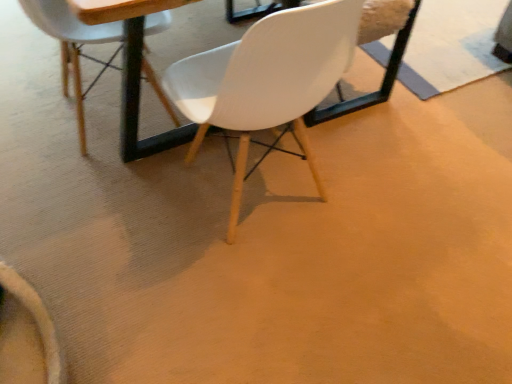
Image resolution: width=512 pixels, height=384 pixels. In order to click on white matte chair at center, the second chair from the left in this screenshot , I will do `click(266, 79)`.

Considering the relative sizes of matte white chair at upper center, which appears as the first chair when viewed from the left, and wooden round table at center in the image provided, is matte white chair at upper center, which appears as the first chair when viewed from the left, bigger than wooden round table at center?

No, matte white chair at upper center, which appears as the first chair when viewed from the left, is not bigger than wooden round table at center.

Which point is more forward, (159, 98) or (188, 2)?

Point (188, 2)

Between matte white chair at upper center, which appears as the first chair when viewed from the left, and wooden round table at center, which one has more height?

wooden round table at center.

From the image's perspective, is matte white chair at upper center, which ranks as the second chair in right-to-left order, positioned above or below wooden round table at center?

matte white chair at upper center, which ranks as the second chair in right-to-left order, is below wooden round table at center.

Can you confirm if white matte chair at center, acting as the 1th chair starting from the right, is positioned to the right of wooden round table at center?

Yes.

Which of these two, white matte chair at center, the second chair from the left, or wooden round table at center, stands taller?

white matte chair at center, the second chair from the left, is taller.

Can wooden round table at center be found inside white matte chair at center, acting as the 1th chair starting from the right?

No, wooden round table at center is not surrounded by white matte chair at center, acting as the 1th chair starting from the right.

Which is behind, point (195, 137) or point (96, 3)?

The point (195, 137) is farther from the camera.

Between point (79, 75) and point (243, 156), which one is positioned in front?

The point (243, 156) is closer to the camera.

Can you confirm if matte white chair at upper center, which ranks as the second chair in right-to-left order, is thinner than white matte chair at center, acting as the 1th chair starting from the right?

In fact, matte white chair at upper center, which ranks as the second chair in right-to-left order, might be wider than white matte chair at center, acting as the 1th chair starting from the right.

Is matte white chair at upper center, which appears as the first chair when viewed from the left, shorter than white matte chair at center, the second chair from the left?

Yes, matte white chair at upper center, which appears as the first chair when viewed from the left, is shorter than white matte chair at center, the second chair from the left.

How much distance is there between matte white chair at upper center, which appears as the first chair when viewed from the left, and white matte chair at center, the second chair from the left?

They are 20.39 inches apart.

Is white matte chair at center, acting as the 1th chair starting from the right, completely or partially inside wooden round table at center?

Yes, white matte chair at center, acting as the 1th chair starting from the right, is inside wooden round table at center.

Is wooden round table at center aimed at white matte chair at center, the second chair from the left?

No, wooden round table at center is not aimed at white matte chair at center, the second chair from the left.

Does wooden round table at center have a lesser width compared to white matte chair at center, the second chair from the left?

No.

The width and height of the screenshot is (512, 384). Identify the location of chair above the wooden round table at center (from a real-world perspective). (266, 79).

Based on their positions, is wooden round table at center located to the left or right of matte white chair at upper center, which appears as the first chair when viewed from the left?

In the image, wooden round table at center appears on the right side of matte white chair at upper center, which appears as the first chair when viewed from the left.

From a real-world perspective, between wooden round table at center and matte white chair at upper center, which appears as the first chair when viewed from the left, who is vertically lower?

matte white chair at upper center, which appears as the first chair when viewed from the left, is physically lower.

Is wooden round table at center far from matte white chair at upper center, which appears as the first chair when viewed from the left?

Actually, wooden round table at center and matte white chair at upper center, which appears as the first chair when viewed from the left, are a little close together.

Does white matte chair at center, the second chair from the left, have a greater width compared to matte white chair at upper center, which ranks as the second chair in right-to-left order?

No, white matte chair at center, the second chair from the left, is not wider than matte white chair at upper center, which ranks as the second chair in right-to-left order.

Choose the correct answer: Is white matte chair at center, the second chair from the left, inside matte white chair at upper center, which appears as the first chair when viewed from the left, or outside it?

Result: white matte chair at center, the second chair from the left, exists outside the volume of matte white chair at upper center, which appears as the first chair when viewed from the left.

Can you tell me how much white matte chair at center, the second chair from the left, and matte white chair at upper center, which ranks as the second chair in right-to-left order, differ in facing direction?

The angle between the facing direction of white matte chair at center, the second chair from the left, and the facing direction of matte white chair at upper center, which ranks as the second chair in right-to-left order, is 88.4 degrees.

Consider the image. Is white matte chair at center, the second chair from the left, looking in the opposite direction of matte white chair at upper center, which ranks as the second chair in right-to-left order?

No, white matte chair at center, the second chair from the left,'s orientation is not away from matte white chair at upper center, which ranks as the second chair in right-to-left order.

Identify the location of chair below the wooden round table at center (from a real-world perspective). (73, 47).

Find the location of a particular element. chair above the wooden round table at center (from a real-world perspective) is located at coordinates (266, 79).

When comparing their distances from white matte chair at center, the second chair from the left, does wooden round table at center or matte white chair at upper center, which appears as the first chair when viewed from the left, seem further?

matte white chair at upper center, which appears as the first chair when viewed from the left, is further to white matte chair at center, the second chair from the left.

From the image, which object appears to be farther from wooden round table at center, white matte chair at center, acting as the 1th chair starting from the right, or matte white chair at upper center, which appears as the first chair when viewed from the left?

Based on the image, white matte chair at center, acting as the 1th chair starting from the right, appears to be further to wooden round table at center.

Based on their spatial positions, is wooden round table at center or white matte chair at center, acting as the 1th chair starting from the right, further from matte white chair at upper center, which appears as the first chair when viewed from the left?

Among the two, white matte chair at center, acting as the 1th chair starting from the right, is located further to matte white chair at upper center, which appears as the first chair when viewed from the left.

Which object lies nearer to the anchor point matte white chair at upper center, which appears as the first chair when viewed from the left, white matte chair at center, the second chair from the left, or wooden round table at center?

wooden round table at center lies closer to matte white chair at upper center, which appears as the first chair when viewed from the left, than the other object.

Considering their positions, is matte white chair at upper center, which ranks as the second chair in right-to-left order, positioned closer to wooden round table at center than white matte chair at center, acting as the 1th chair starting from the right?

matte white chair at upper center, which ranks as the second chair in right-to-left order.

Considering their positions, is matte white chair at upper center, which ranks as the second chair in right-to-left order, positioned further to white matte chair at center, acting as the 1th chair starting from the right, than wooden round table at center?

matte white chair at upper center, which ranks as the second chair in right-to-left order, is further to white matte chair at center, acting as the 1th chair starting from the right.

Image resolution: width=512 pixels, height=384 pixels. I want to click on round table between matte white chair at upper center, which appears as the first chair when viewed from the left, and white matte chair at center, the second chair from the left, so click(130, 64).